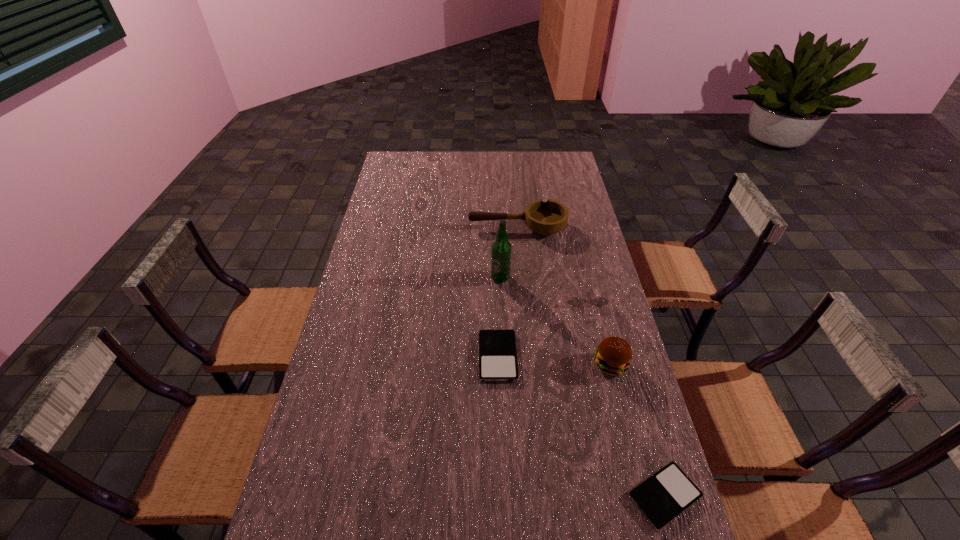
You are a GUI agent. You are given a task and a screenshot of the screen. Output one action in this format:
    pyautogui.click(x=<x>, y=<y>)
    Task: Click on the hamburger
    The height and width of the screenshot is (540, 960).
    Given the screenshot: What is the action you would take?
    pyautogui.click(x=613, y=356)

This screenshot has width=960, height=540. I want to click on vacant area situated 0.120m on the back of the taller iPod, so click(496, 305).

Identify the location of free space located on the back of the right iPod. (619, 339).

Locate an element on the screen. This screenshot has width=960, height=540. free space located 0.080m on the face of the sunglasses is located at coordinates (591, 325).

Where is `free space located 0.170m on the label of the beer bottle`? This screenshot has height=540, width=960. free space located 0.170m on the label of the beer bottle is located at coordinates (502, 322).

Identify the location of vacant area situated with the handle on the side of the saucepan. Image resolution: width=960 pixels, height=540 pixels. (439, 227).

Locate an element on the screen. This screenshot has height=540, width=960. free space located 0.080m with the handle on the side of the saucepan is located at coordinates (448, 227).

Identify the location of free space located with the handle on the side of the saucepan. (381, 227).

In order to click on vacant area located on the left of the fifth shortest object in this screenshot , I will do click(x=504, y=364).

Identify the location of object that is positioned at the near edge. This screenshot has width=960, height=540. (662, 497).